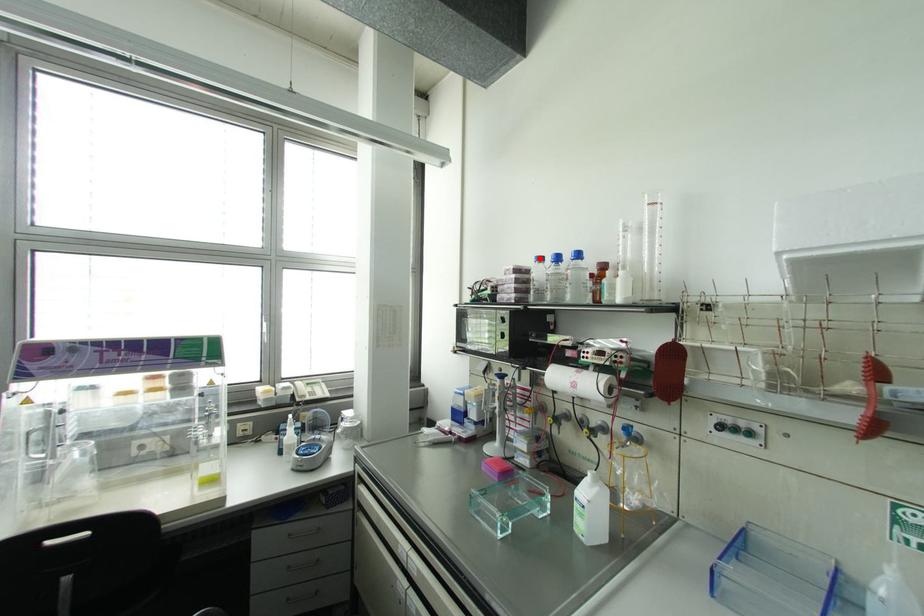
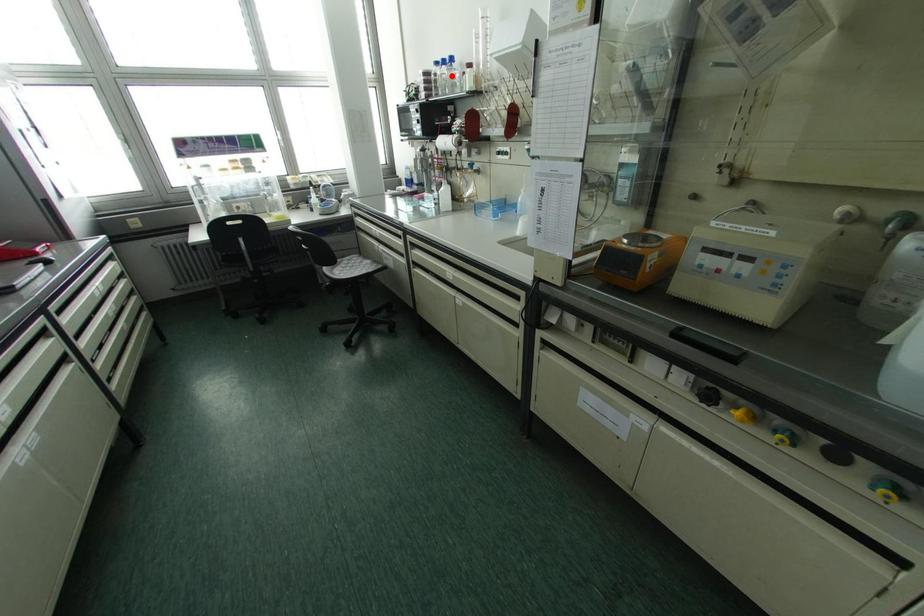
I am providing you with two images of the same scene from different viewpoints. A red point is marked on the first image and another point is marked on the second image. Does the point marked in image1 correspond to the same location as the one in image2?

No